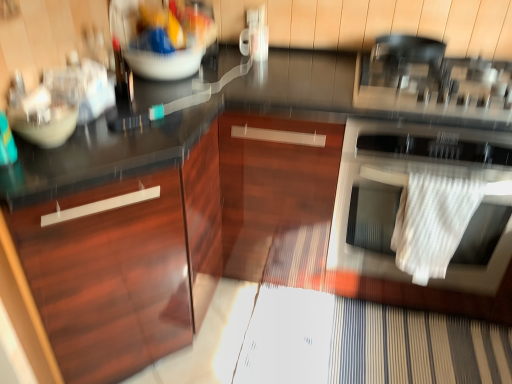
Where is `vacant area on top of glossy wood cabinet at left (from a real-world perspective)`? vacant area on top of glossy wood cabinet at left (from a real-world perspective) is located at coordinates (105, 139).